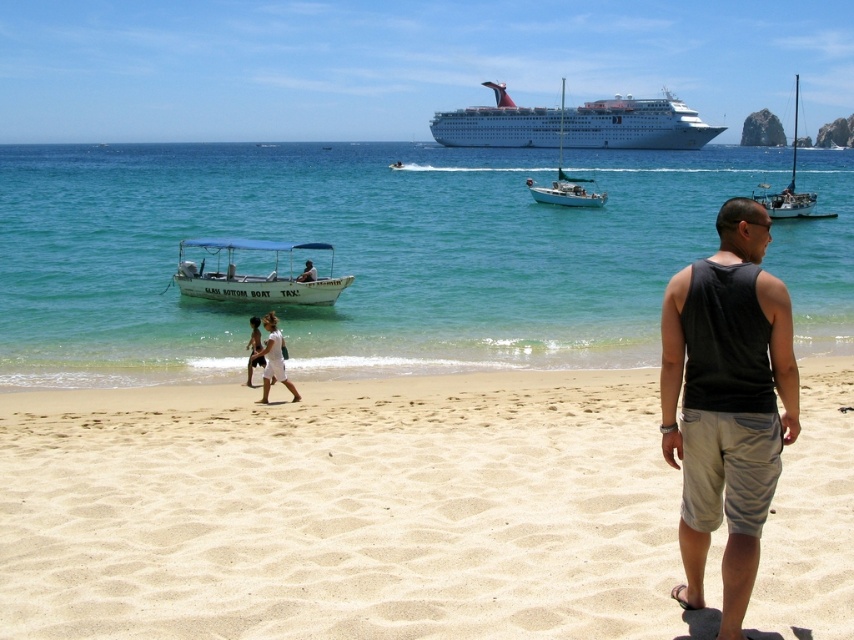
From the picture: Can you confirm if black cotton tank top at right is taller than white glossy sailboat at center?

No, black cotton tank top at right is not taller than white glossy sailboat at center.

Between black cotton tank top at right and white glossy sailboat at center, which one has less height?

black cotton tank top at right

Is point (753, 493) behind point (577, 180)?

That is False.

At what (x,y) coordinates should I click in order to perform the action: click on black cotton tank top at right. Please return your answer as a coordinate pair (x, y). This screenshot has width=854, height=640. Looking at the image, I should click on (727, 401).

Is point (325, 300) less distant than point (297, 278)?

That is True.

Does point (317, 241) come behind point (303, 275)?

Yes, it is.

Who is more distant from viewer, (296, 296) or (305, 264)?

The point (305, 264) is behind.

I want to click on white matte motor boat at center, so click(255, 275).

What do you see at coordinates (349, 253) in the screenshot?
I see `clear blue water at beach front` at bounding box center [349, 253].

Does clear blue water at beach front appear on the left side of white glossy sailboat at center?

Correct, you'll find clear blue water at beach front to the left of white glossy sailboat at center.

This screenshot has width=854, height=640. Identify the location of clear blue water at beach front. (349, 253).